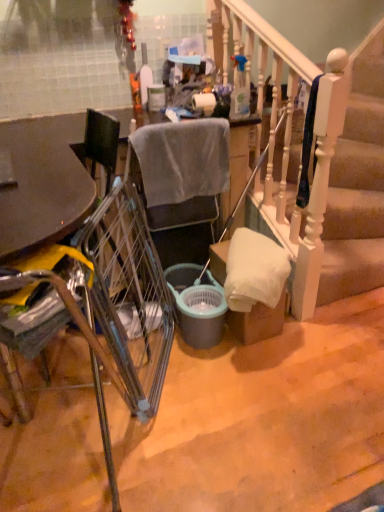
Question: From the image's perspective, is metallic silver chair at left, marked as the first chair in a front-to-back arrangement, below metallic silver trolley at center?

Choices:
 (A) no
 (B) yes

Answer: (B)

Question: Would you say metallic silver chair at left, marked as the first chair in a front-to-back arrangement, is outside metallic silver trolley at center?

Choices:
 (A) yes
 (B) no

Answer: (A)

Question: Is metallic silver trolley at center inside metallic silver chair at left, arranged as the second chair when viewed from the back?

Choices:
 (A) no
 (B) yes

Answer: (A)

Question: Considering the relative sizes of metallic silver chair at left, arranged as the second chair when viewed from the back, and metallic silver trolley at center in the image provided, is metallic silver chair at left, arranged as the second chair when viewed from the back, shorter than metallic silver trolley at center?

Choices:
 (A) no
 (B) yes

Answer: (A)

Question: Is metallic silver chair at left, arranged as the second chair when viewed from the back, turned away from metallic silver trolley at center?

Choices:
 (A) no
 (B) yes

Answer: (A)

Question: In terms of width, does white matte toilet paper at center look wider or thinner when compared to matte plastic trash can at center?

Choices:
 (A) wide
 (B) thin

Answer: (B)

Question: Does point (200, 96) appear closer or farther from the camera than point (152, 89)?

Choices:
 (A) farther
 (B) closer

Answer: (B)

Question: From the image's perspective, is white matte toilet paper at center above or below matte plastic trash can at center?

Choices:
 (A) above
 (B) below

Answer: (B)

Question: In terms of height, does white matte toilet paper at center look taller or shorter compared to matte plastic trash can at center?

Choices:
 (A) short
 (B) tall

Answer: (A)

Question: Is metallic silver chair at left, marked as the first chair in a front-to-back arrangement, to the left or to the right of matte gray bucket at center in the image?

Choices:
 (A) right
 (B) left

Answer: (B)

Question: In terms of size, does metallic silver chair at left, marked as the first chair in a front-to-back arrangement, appear bigger or smaller than matte gray bucket at center?

Choices:
 (A) small
 (B) big

Answer: (B)

Question: Looking at their shapes, would you say metallic silver chair at left, arranged as the second chair when viewed from the back, is wider or thinner than matte gray bucket at center?

Choices:
 (A) thin
 (B) wide

Answer: (B)

Question: Choose the correct answer: Is metallic silver chair at left, marked as the first chair in a front-to-back arrangement, inside matte gray bucket at center or outside it?

Choices:
 (A) outside
 (B) inside

Answer: (A)

Question: From a real-world perspective, relative to translucent plastic bottle at upper center, the 2th bottle from the front, is gray fabric chair at center, the 2th chair when ordered from front to back, vertically above or below?

Choices:
 (A) above
 (B) below

Answer: (B)

Question: Is gray fabric chair at center, which is the first chair from back to front, bigger or smaller than translucent plastic bottle at upper center, the 2th bottle from the front?

Choices:
 (A) small
 (B) big

Answer: (B)